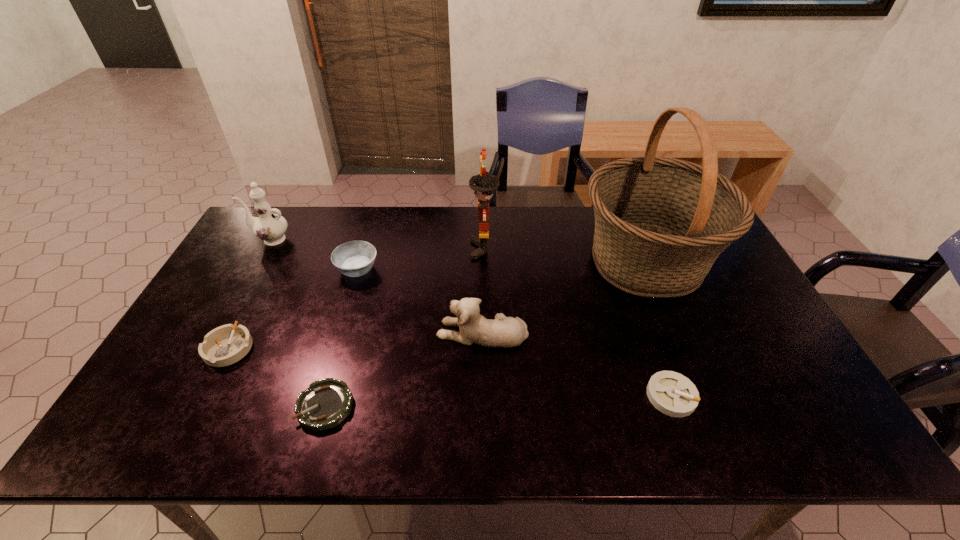
At what (x,y) coordinates should I click in order to perform the action: click on free spot between the second farthest ashtray and the shortest ashtray. Please return your answer as a coordinate pair (x, y). This screenshot has height=540, width=960. Looking at the image, I should click on (277, 377).

The width and height of the screenshot is (960, 540). Find the location of `object that is the seventh closest to the fifth shortest object`. object that is the seventh closest to the fifth shortest object is located at coordinates (269, 227).

Choose which object is the fifth nearest neighbor to the basket. Please provide its 2D coordinates. Your answer should be formatted as a tuple, i.e. [(x, y)], where the tuple contains the x and y coordinates of a point satisfying the conditions above.

[(327, 402)]

Identify the location of the third closest ashtray to the fourth tallest object. The image size is (960, 540). (673, 394).

Choose which ashtray is the nearest neighbor to the shortest ashtray. Please provide its 2D coordinates. Your answer should be formatted as a tuple, i.e. [(x, y)], where the tuple contains the x and y coordinates of a point satisfying the conditions above.

[(225, 345)]

The height and width of the screenshot is (540, 960). In order to click on free space that satisfies the following two spatial constraints: 1. on the front-facing side of the nutcracker; 2. on the right side of the tallest object in this screenshot , I will do `click(484, 262)`.

The image size is (960, 540). In order to click on vacant space that satisfies the following two spatial constraints: 1. on the front-facing side of the fifth shortest object; 2. on the front side of the third nearest ashtray in this screenshot , I will do `click(482, 348)`.

The image size is (960, 540). In order to click on free space that satisfies the following two spatial constraints: 1. at the spout of the chinaware; 2. on the right side of the farthest ashtray in this screenshot , I will do `click(253, 269)`.

At what (x,y) coordinates should I click in order to perform the action: click on vacant area in the image that satisfies the following two spatial constraints: 1. on the front side of the leftmost ashtray; 2. on the right side of the shortest ashtray. Please return your answer as a coordinate pair (x, y). The image size is (960, 540). Looking at the image, I should click on (199, 406).

The height and width of the screenshot is (540, 960). What are the coordinates of `vacant point that satisfies the following two spatial constraints: 1. at the spout of the chinaware; 2. on the right side of the tallest ashtray` in the screenshot? It's located at (253, 269).